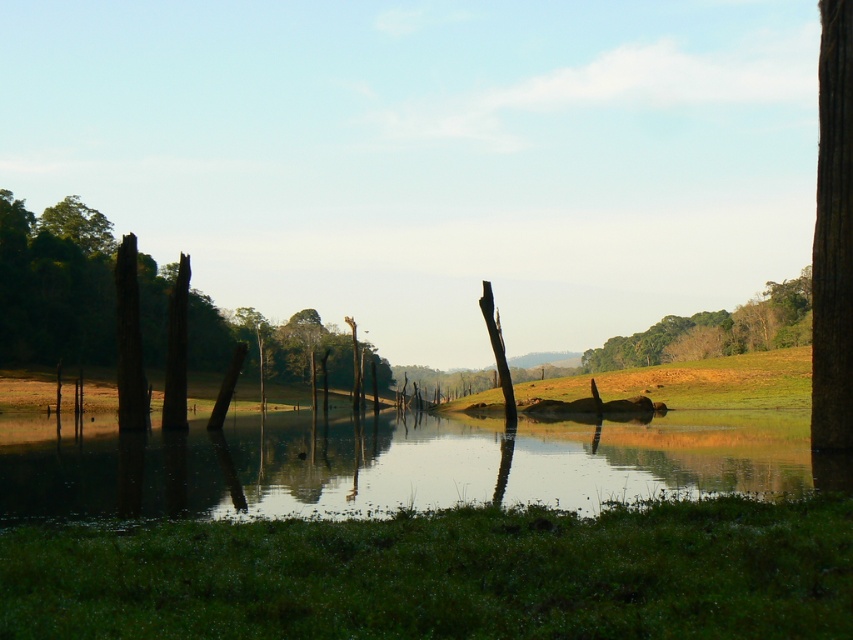
Consider the image. Is clear water at center below green leafy tree at upper left?

Yes, clear water at center is below green leafy tree at upper left.

Does point (583, 500) come behind point (67, 205)?

No, (583, 500) is closer to viewer.

Identify the location of clear water at center. The height and width of the screenshot is (640, 853). (392, 464).

Where is `clear water at center`? The height and width of the screenshot is (640, 853). clear water at center is located at coordinates (392, 464).

In the scene shown: Does green matte tree at upper center have a greater height compared to green leafy tree at upper left?

Yes, green matte tree at upper center is taller than green leafy tree at upper left.

Which is behind, point (668, 332) or point (54, 221)?

The point (668, 332) is more distant.

Find the location of a particular element. The height and width of the screenshot is (640, 853). green matte tree at upper center is located at coordinates (715, 330).

Is point (189, 292) in front of point (776, 310)?

That is False.

Between smooth brown tree trunk at left and green matte tree at upper center, which one has more height?

With more height is smooth brown tree trunk at left.

Does point (62, 316) come farther from viewer compared to point (625, 360)?

No, it is in front of (625, 360).

Where is `smooth brown tree trunk at left`? The height and width of the screenshot is (640, 853). smooth brown tree trunk at left is located at coordinates (56, 284).